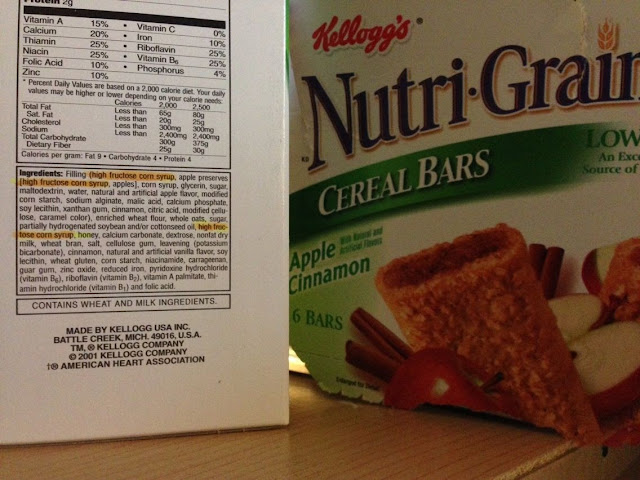
Where is `table`? Image resolution: width=640 pixels, height=480 pixels. table is located at coordinates (408, 438).